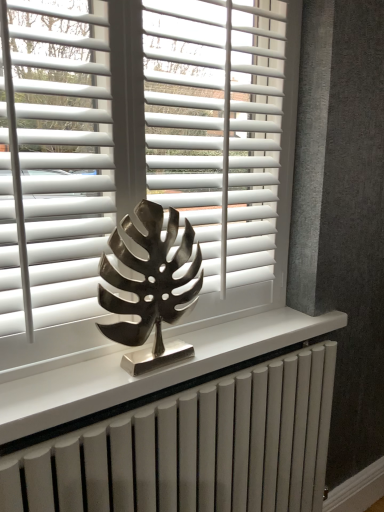
Describe the element at coordinates (141, 169) in the screenshot. The width and height of the screenshot is (384, 512). I see `white matte blinds at center` at that location.

What do you see at coordinates (194, 448) in the screenshot? The image size is (384, 512). I see `white metallic radiator at center` at bounding box center [194, 448].

This screenshot has height=512, width=384. Identify the location of metallic leaf sculpture at center. (150, 287).

Is point (330, 352) positioned after point (193, 126)?

Yes, point (330, 352) is farther from viewer.

The width and height of the screenshot is (384, 512). I want to click on blind behind the white metallic radiator at center, so click(x=217, y=127).

Which of these two, white metallic radiator at center or white matte blinds at center, which ranks as the 1th blind in right-to-left order, is smaller?

With smaller size is white matte blinds at center, which ranks as the 1th blind in right-to-left order.

Who is more distant, white metallic radiator at center or white matte blinds at center, which ranks as the 1th blind in right-to-left order?

white matte blinds at center, which ranks as the 1th blind in right-to-left order, is behind.

Can you confirm if white matte blinds at center is bigger than metallic leaf sculpture at center?

Yes, white matte blinds at center is bigger than metallic leaf sculpture at center.

Considering the points (212, 301) and (121, 337), which point is in front, point (212, 301) or point (121, 337)?

Point (121, 337)

Is white matte blinds at center aimed at metallic leaf sculpture at center?

Yes, white matte blinds at center is turned towards metallic leaf sculpture at center.

Is white matte blinds at center not near metallic leaf sculpture at center?

white matte blinds at center is near metallic leaf sculpture at center, not far away.

Between white matte blinds at center, which is the 2th blind in right-to-left order, and white matte blinds at center, which ranks as the 1th blind in right-to-left order, which one has larger size?

Bigger between the two is white matte blinds at center, which ranks as the 1th blind in right-to-left order.

Considering the relative sizes of white matte blinds at center, placed as the first blind when sorted from left to right, and white matte blinds at center, which ranks as the 1th blind in right-to-left order, in the image provided, is white matte blinds at center, placed as the first blind when sorted from left to right, thinner than white matte blinds at center, which ranks as the 1th blind in right-to-left order,?

Yes, white matte blinds at center, placed as the first blind when sorted from left to right, is thinner than white matte blinds at center, which ranks as the 1th blind in right-to-left order.

Find the location of a particular element. blind that appears above the white matte blinds at center, which is the 2th blind in right-to-left order (from a real-world perspective) is located at coordinates (217, 127).

What's the angular difference between metallic leaf sculpture at center and white metallic radiator at center's facing directions?

0.00132 degrees separate the facing orientations of metallic leaf sculpture at center and white metallic radiator at center.

Is white metallic radiator at center located within metallic leaf sculpture at center?

No, white metallic radiator at center is not surrounded by metallic leaf sculpture at center.

Visually, is metallic leaf sculpture at center positioned to the left or to the right of white metallic radiator at center?

From the image, it's evident that metallic leaf sculpture at center is to the left of white metallic radiator at center.

From a real-world perspective, is white matte blinds at center physically below white matte blinds at center, which ranks as the 1th blind in right-to-left order?

Yes, from a real-world perspective, white matte blinds at center is under white matte blinds at center, which ranks as the 1th blind in right-to-left order.

Which object is positioned more to the right, white matte blinds at center or white matte blinds at center, which ranks as the 1th blind in right-to-left order?

From the viewer's perspective, white matte blinds at center, which ranks as the 1th blind in right-to-left order, appears more on the right side.

Are white matte blinds at center and white matte blinds at center, which is the 2th blind in left-to-right order, far apart?

No, white matte blinds at center is not far from white matte blinds at center, which is the 2th blind in left-to-right order.

The width and height of the screenshot is (384, 512). I want to click on radiator lying behind the white matte blinds at center, which is the 2th blind in right-to-left order, so click(x=194, y=448).

Are white matte blinds at center, which is the 2th blind in right-to-left order, and white metallic radiator at center located far from each other?

They are positioned close to each other.

Visually, is white matte blinds at center, which is the 2th blind in right-to-left order, positioned to the left or to the right of white metallic radiator at center?

Clearly, white matte blinds at center, which is the 2th blind in right-to-left order, is on the left of white metallic radiator at center in the image.

How many degrees apart are the facing directions of white matte blinds at center, which is the 2th blind in right-to-left order, and white metallic radiator at center?

The facing directions of white matte blinds at center, which is the 2th blind in right-to-left order, and white metallic radiator at center are 0.00282 degrees apart.

Is the position of metallic leaf sculpture at center more distant than that of white matte blinds at center, placed as the first blind when sorted from left to right?

Yes.

Can you confirm if metallic leaf sculpture at center is positioned to the right of white matte blinds at center, which is the 2th blind in right-to-left order?

Yes, metallic leaf sculpture at center is to the right of white matte blinds at center, which is the 2th blind in right-to-left order.

Could you tell me if metallic leaf sculpture at center is facing white matte blinds at center, placed as the first blind when sorted from left to right?

No.

Are metallic leaf sculpture at center and white matte blinds at center, which is the 2th blind in right-to-left order, making contact?

No, metallic leaf sculpture at center is not making contact with white matte blinds at center, which is the 2th blind in right-to-left order.

The image size is (384, 512). I want to click on blind that is the 2nd one above the white metallic radiator at center (from a real-world perspective), so click(x=217, y=127).

Where is `sculpture located below the white matte blinds at center (from the image's perspective)`? This screenshot has height=512, width=384. sculpture located below the white matte blinds at center (from the image's perspective) is located at coordinates (150, 287).

Looking at the image, which one is located closer to white matte blinds at center, placed as the first blind when sorted from left to right, metallic leaf sculpture at center or white matte blinds at center, which ranks as the 1th blind in right-to-left order?

metallic leaf sculpture at center is closer to white matte blinds at center, placed as the first blind when sorted from left to right.

When comparing their distances from white matte blinds at center, does white matte blinds at center, placed as the first blind when sorted from left to right, or white matte blinds at center, which is the 2th blind in left-to-right order, seem further?

white matte blinds at center, placed as the first blind when sorted from left to right, lies further to white matte blinds at center than the other object.

Based on their spatial positions, is white matte blinds at center or white matte blinds at center, which is the 2th blind in right-to-left order, further from metallic leaf sculpture at center?

white matte blinds at center, which is the 2th blind in right-to-left order.

Considering their positions, is white matte blinds at center, which is the 2th blind in left-to-right order, positioned further to white metallic radiator at center than white matte blinds at center, placed as the first blind when sorted from left to right?

The object further to white metallic radiator at center is white matte blinds at center, which is the 2th blind in left-to-right order.

From the image, which object appears to be nearer to white matte blinds at center, which is the 2th blind in right-to-left order, white metallic radiator at center or white matte blinds at center, which ranks as the 1th blind in right-to-left order?

Among the two, white matte blinds at center, which ranks as the 1th blind in right-to-left order, is located nearer to white matte blinds at center, which is the 2th blind in right-to-left order.

When comparing their distances from white metallic radiator at center, does white matte blinds at center, which is the 2th blind in right-to-left order, or white matte blinds at center seem further?

Among the two, white matte blinds at center, which is the 2th blind in right-to-left order, is located further to white metallic radiator at center.

Considering their positions, is white matte blinds at center, which is the 2th blind in left-to-right order, positioned further to white matte blinds at center, which is the 2th blind in right-to-left order, than metallic leaf sculpture at center?

white matte blinds at center, which is the 2th blind in left-to-right order, lies further to white matte blinds at center, which is the 2th blind in right-to-left order, than the other object.

Which object lies nearer to the anchor point white matte blinds at center, which is the 2th blind in left-to-right order, white matte blinds at center, placed as the first blind when sorted from left to right, or metallic leaf sculpture at center?

Based on the image, metallic leaf sculpture at center appears to be nearer to white matte blinds at center, which is the 2th blind in left-to-right order.

Identify the location of sculpture between white matte blinds at center, placed as the first blind when sorted from left to right, and white metallic radiator at center, in the vertical direction. The width and height of the screenshot is (384, 512). pos(150,287).

This screenshot has width=384, height=512. What are the coordinates of `window blind situated between white matte blinds at center, which is the 2th blind in right-to-left order, and white matte blinds at center, which is the 2th blind in left-to-right order, from left to right` in the screenshot? It's located at (141, 169).

What are the coordinates of `blind between white matte blinds at center and metallic leaf sculpture at center vertically` in the screenshot? It's located at (53, 162).

Locate an element on the screen. The height and width of the screenshot is (512, 384). blind between white matte blinds at center, which ranks as the 1th blind in right-to-left order, and white metallic radiator at center from top to bottom is located at coordinates (53, 162).